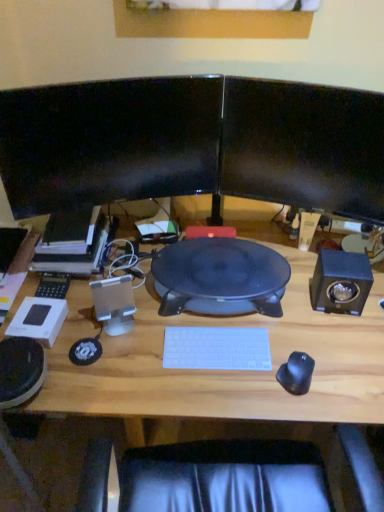
Identify the location of free space to the right of black rubberized mouse at right. (342, 372).